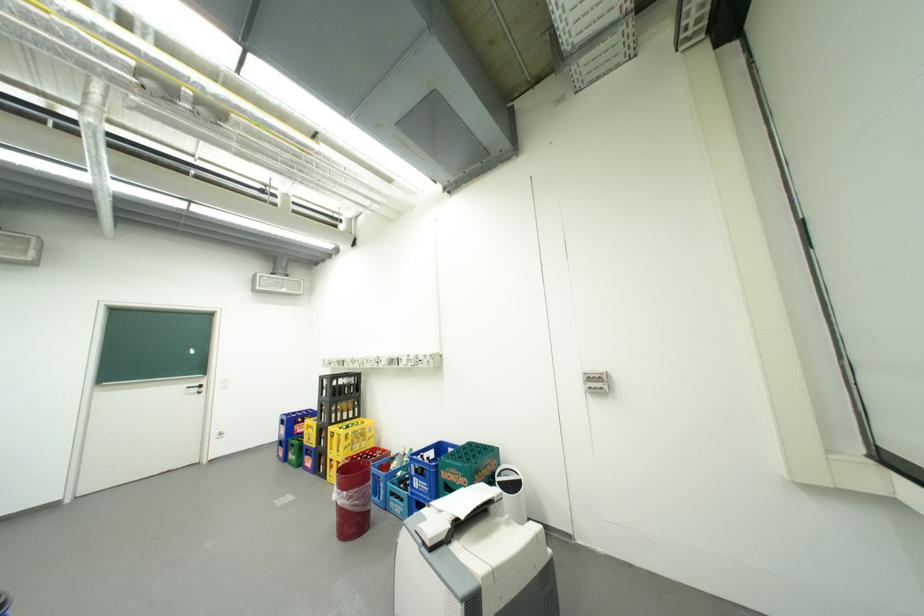
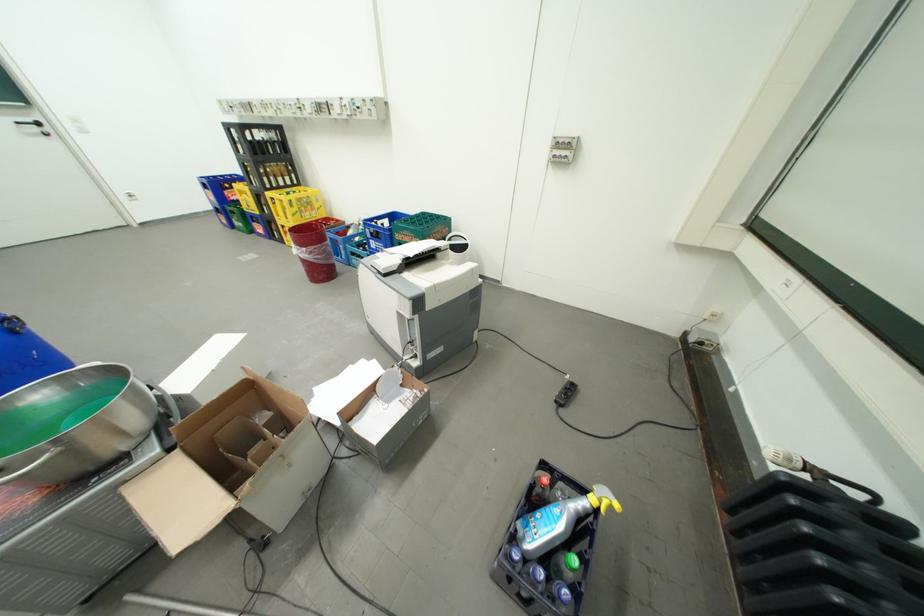
Find the pixel in the second image that matches point 424,480 in the first image.

(381, 241)